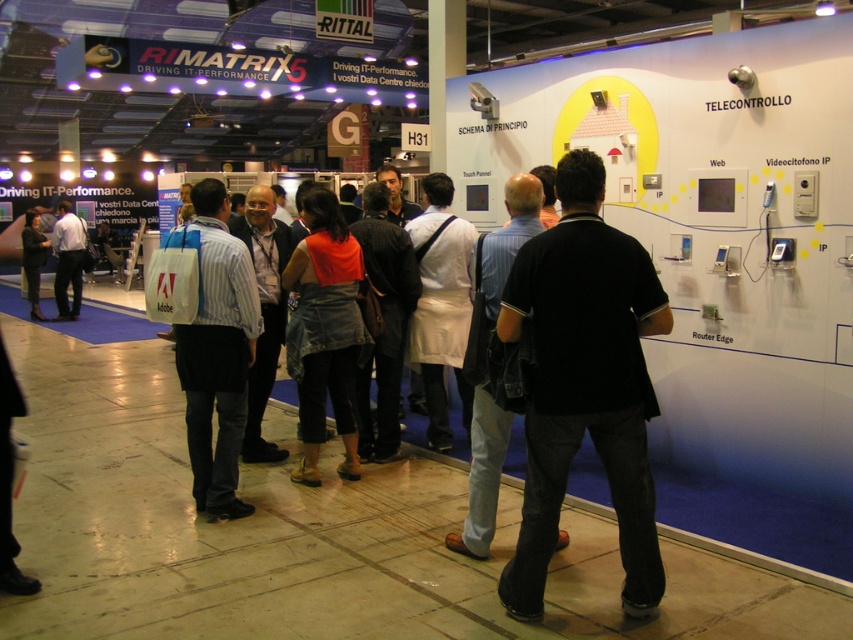
Question: Among these points, which one is nearest to the camera?

Choices:
 (A) (209, 216)
 (B) (440, 195)
 (C) (546, 529)

Answer: (C)

Question: Estimate the real-world distances between objects in this image. Which object is farther from the white fabric apron at center?

Choices:
 (A) denim jacket at left
 (B) striped cotton shirt at center

Answer: (A)

Question: Is black cotton shirt at center thinner than white fabric apron at center?

Choices:
 (A) no
 (B) yes

Answer: (A)

Question: Does dark blue jeans at left appear over denim jacket at left?

Choices:
 (A) no
 (B) yes

Answer: (B)

Question: Considering the relative positions of black cotton shirt at center and black fabric shirt at center in the image provided, where is black cotton shirt at center located with respect to black fabric shirt at center?

Choices:
 (A) below
 (B) above

Answer: (B)

Question: Considering the real-world distances, which object is farthest from the dark blue jeans at left?

Choices:
 (A) denim jacket at left
 (B) denim skirt at center

Answer: (B)